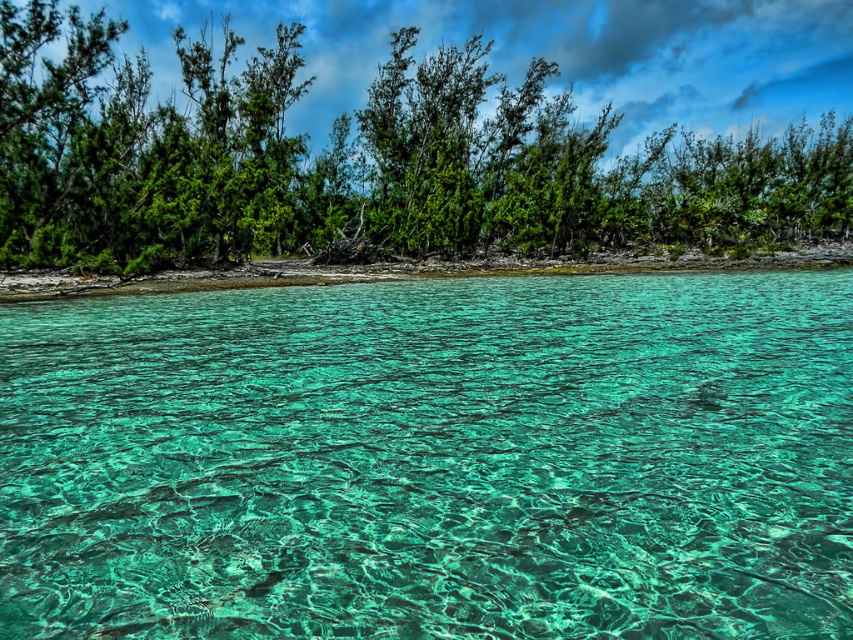
Looking at this image, you are a photographer planning to capture a landscape shot of the translucent teal water at center and the green leafy trees at upper center. Based on the scene, which object will appear closer to the camera in the final photo?

The translucent teal water at center will appear closer to the camera in the final photo because it is positioned in front of the green leafy trees at upper center.

You are a marine biologist planning to swim from the translucent teal water at center to the green leafy trees at upper center. The safety regulations state that you must stay within 50 meters of the shore. Will you be able to comply with this rule while reaching your destination?

The distance between the translucent teal water at center and the green leafy trees at upper center is 44.40 meters, which is within the 50 meters safety regulation. Therefore, you can swim to the green leafy trees at upper center while staying within the required distance.

You are a photographer planning to capture the entire scene in one shot. Given that the translucent teal water at center and the green leafy trees at upper center are both in view, which of these two elements occupies a smaller horizontal space in the image?

The translucent teal water at center occupies a smaller horizontal space because its width is less than that of the green leafy trees at upper center.